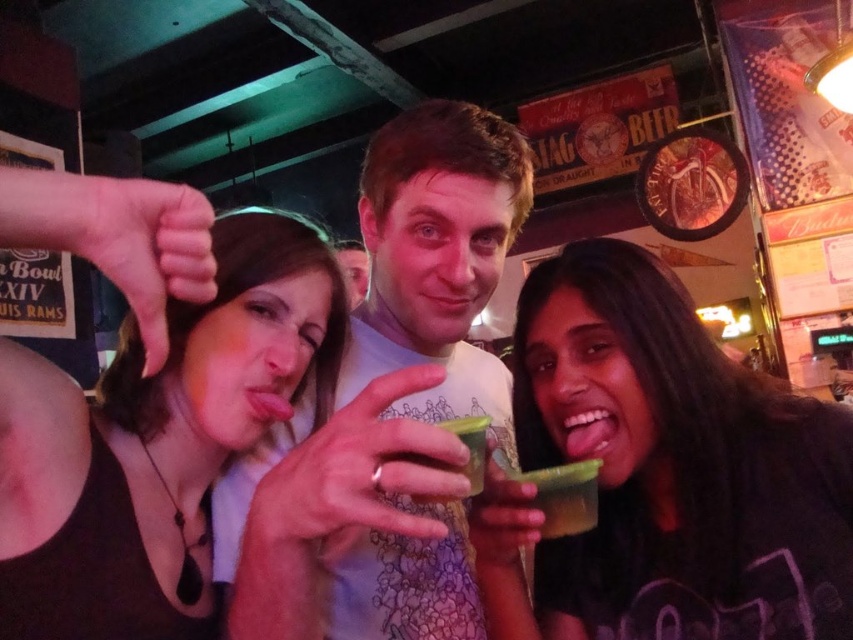
Question: Considering the relative positions of green matte cup at center and green translucent cup at center in the image provided, where is green matte cup at center located with respect to green translucent cup at center?

Choices:
 (A) below
 (B) above

Answer: (A)

Question: Can you confirm if matte black tank top at upper left is positioned above matte white t-shirt at center?

Choices:
 (A) no
 (B) yes

Answer: (A)

Question: Which point is farther from the camera taking this photo?

Choices:
 (A) (x=553, y=474)
 (B) (x=424, y=122)
 (C) (x=548, y=561)

Answer: (B)

Question: Is matte black tank top at upper left positioned behind green translucent cup at center?

Choices:
 (A) no
 (B) yes

Answer: (B)

Question: Which point is farther to the camera?

Choices:
 (A) green translucent cup at center
 (B) matte black tank top at upper left
 (C) green matte cup at center

Answer: (C)

Question: Which of the following is the farthest from the observer?

Choices:
 (A) (538, 506)
 (B) (312, 317)
 (C) (502, 616)

Answer: (C)